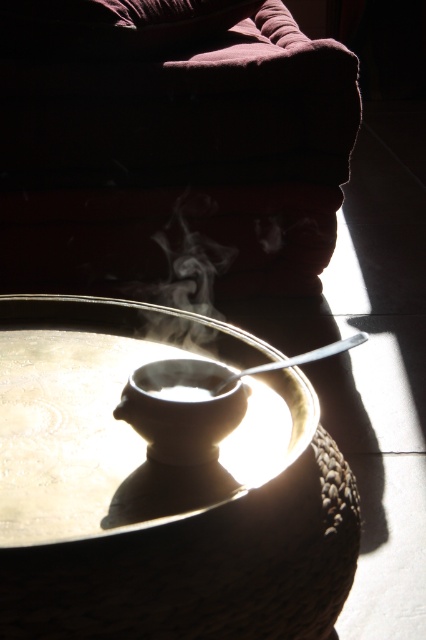
Question: Is velvet-like couch at upper center to the left of white glossy saucer at center from the viewer's perspective?

Choices:
 (A) yes
 (B) no

Answer: (B)

Question: Is white glossy saucer at center smaller than white matte coffee cup at center?

Choices:
 (A) no
 (B) yes

Answer: (A)

Question: Which of the following is the farthest from the observer?

Choices:
 (A) white glossy saucer at center
 (B) white matte coffee cup at center
 (C) velvet-like couch at upper center

Answer: (C)

Question: Is velvet-like couch at upper center below white matte coffee cup at center?

Choices:
 (A) yes
 (B) no

Answer: (B)

Question: Which point is farther from the camera taking this photo?

Choices:
 (A) (216, 392)
 (B) (291, 369)

Answer: (B)

Question: Which of the following is the farthest from the observer?

Choices:
 (A) velvet-like couch at upper center
 (B) white glossy saucer at center

Answer: (A)